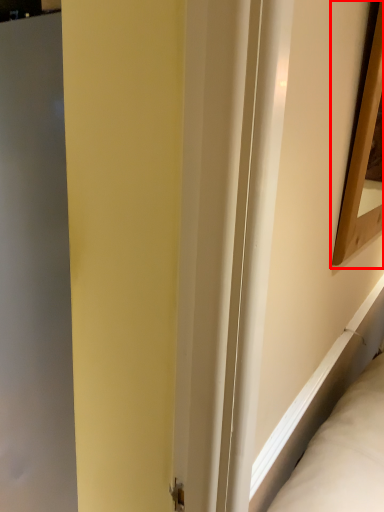
Question: From the image's perspective, what is the correct spatial relationship of picture frame (annotated by the red box) in relation to screen door?

Choices:
 (A) below
 (B) above

Answer: (B)